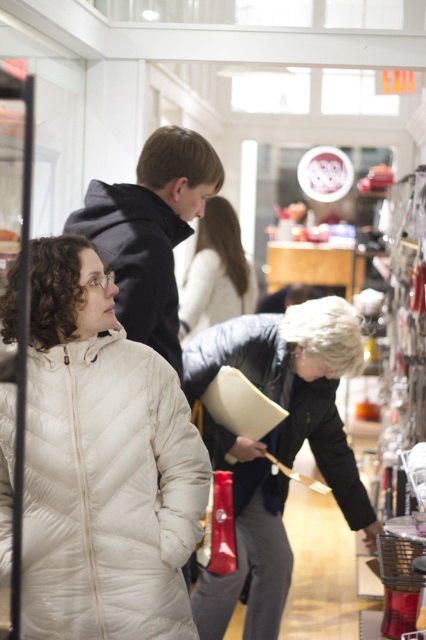
You are a customer in the store and want to find the black quilted coat at center. According to the store layout, where should you look?

The black quilted coat at center is located at point (325, 445), so you should look towards the center of the store to find it.

You are a store employee who needs to place both the black quilted coat at center and the white quilted jacket at center on a display rack that can only accommodate items up to 40 inches in width. Given their widths, which one might not fit and require a wider rack?

The black quilted coat at center has a greater width than the white quilted jacket at center, so the black quilted coat at center might not fit on the display rack and would require a wider rack.